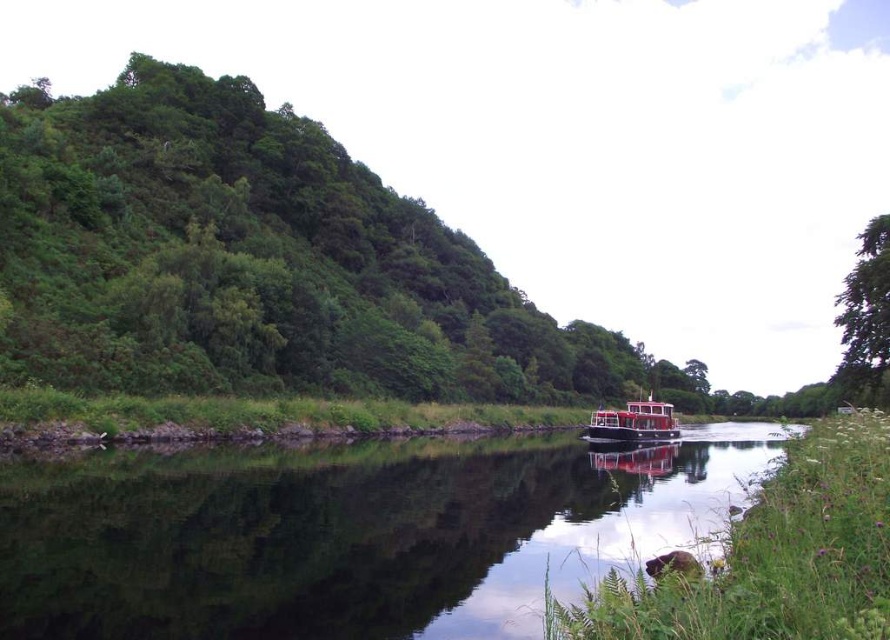
You are standing at the riverside and want to cross to the green leafy hillside at left. The river is flowing from the left to the right. If you start swimming directly towards the hillside, will you reach it? Explain why or why not.

The green leafy hillside at left is 122.58 feet away from the viewer. Since the river is flowing from the left to the right, swimming directly towards the hillside might not be sufficient because the current could carry you downstream away from the hillside. To reach it, you would need to aim upstream to counteract the current.

You are standing at the riverside looking across the scene. You notice two points marked in the image. Which of the two points, point (175,154) or point (641,420), is closer to your current position?

Point (175,154) is closer to your current position because it is further to the viewer than point (641,420).

You are standing on the riverside path and see the green leafy tree at upper right and the red matte boat at center. Which object is positioned higher in the image?

The green leafy tree at upper right is located above the red matte boat at center, so it is positioned higher in the image.